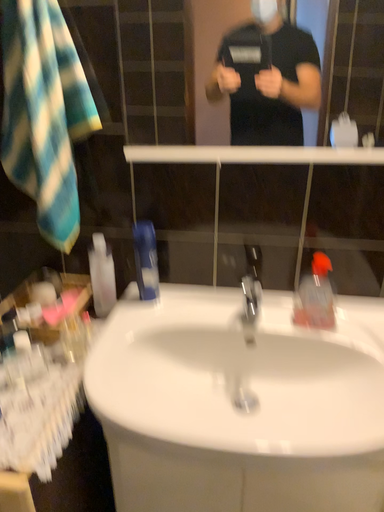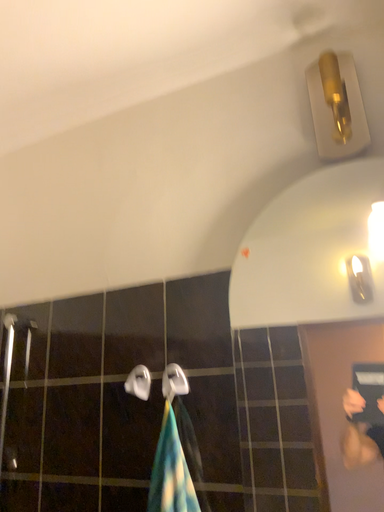
Question: Which way did the camera rotate in the video?

Choices:
 (A) rotated right
 (B) rotated left

Answer: (B)